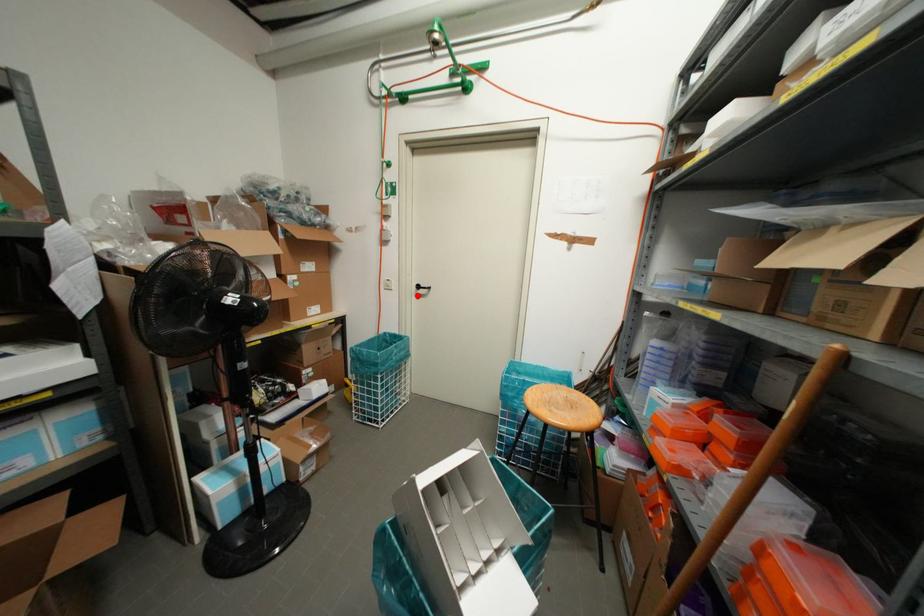
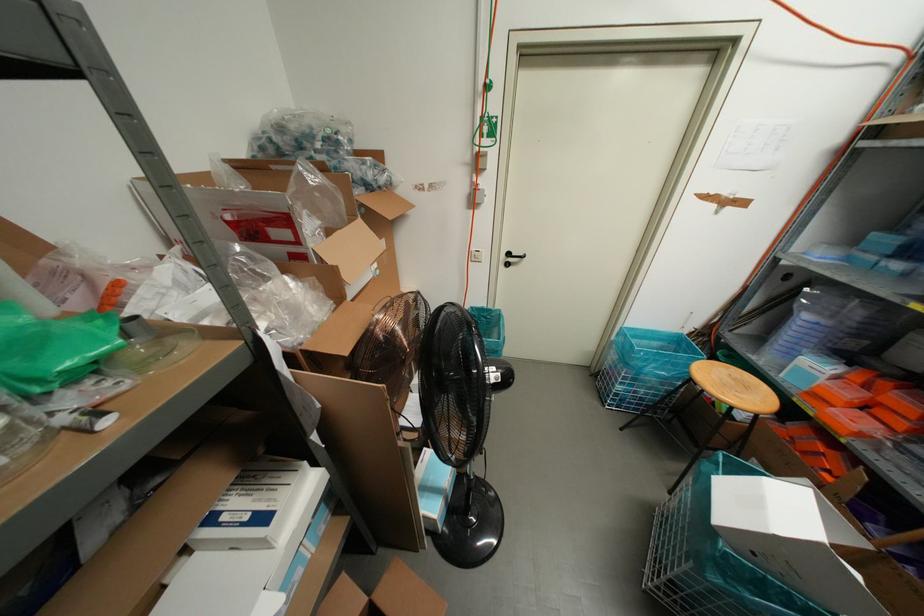
Where in the second image is the point corresponding to the highlighted location from the first image?

(506, 264)